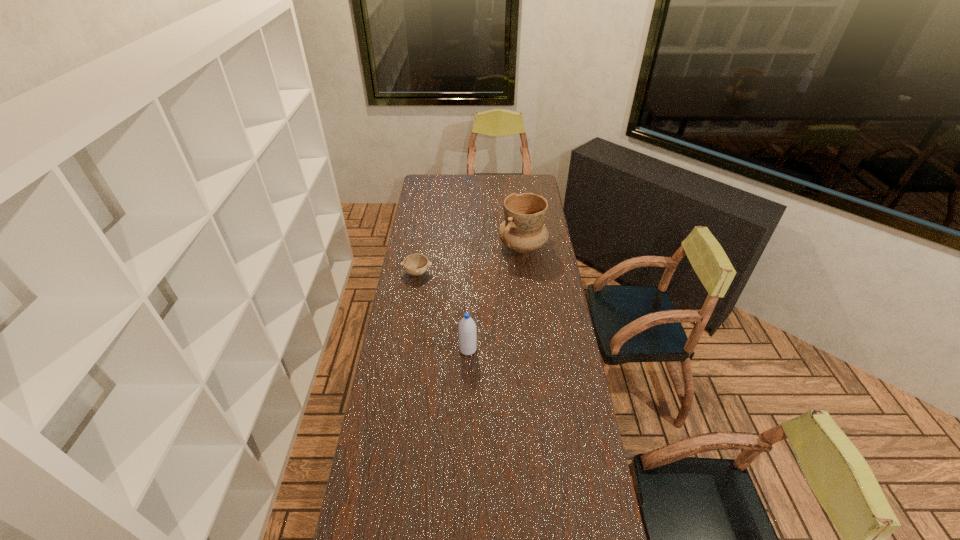
Locate an element on the screen. The image size is (960, 540). object located in the right edge section of the desktop is located at coordinates (523, 230).

Locate an element on the screen. Image resolution: width=960 pixels, height=540 pixels. vacant space at the far edge of the desktop is located at coordinates (463, 184).

This screenshot has width=960, height=540. Find the location of `free region at the left edge`. free region at the left edge is located at coordinates (426, 294).

You are a GUI agent. You are given a task and a screenshot of the screen. Output one action in this format:
    pyautogui.click(x=<x>, y=<y>)
    Task: Click on the free location at the right edge
    Image resolution: width=960 pixels, height=540 pixels.
    Given the screenshot: What is the action you would take?
    pyautogui.click(x=558, y=410)

The width and height of the screenshot is (960, 540). In the image, there is a desktop. Find the location of `vacant space at the far left corner`. vacant space at the far left corner is located at coordinates (444, 186).

In the image, there is a desktop. Identify the location of vacant space at the far right corner. (532, 189).

Where is `free point between the bowl and the tallest object`? This screenshot has height=540, width=960. free point between the bowl and the tallest object is located at coordinates (469, 259).

Where is `unoccupied position between the farthest object and the bowl`? unoccupied position between the farthest object and the bowl is located at coordinates click(x=469, y=259).

This screenshot has width=960, height=540. In order to click on free point between the second shortest object and the leftmost object in this screenshot , I will do `click(443, 311)`.

Where is `free space between the farthest object and the second nearest object`? This screenshot has height=540, width=960. free space between the farthest object and the second nearest object is located at coordinates (469, 259).